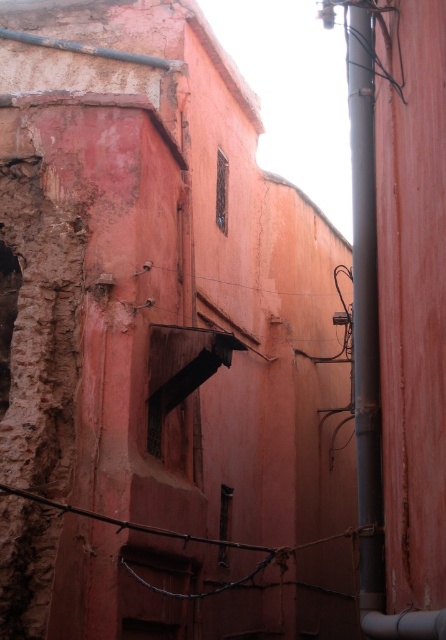
Question: Is metallic pipe at right above rusty metal wire at center?

Choices:
 (A) no
 (B) yes

Answer: (B)

Question: Which of the following is the farthest from the observer?

Choices:
 (A) (351, 150)
 (B) (189, 593)

Answer: (A)

Question: From the image, what is the correct spatial relationship of metallic pipe at right in relation to rusty metal wire at center?

Choices:
 (A) below
 (B) above

Answer: (B)

Question: Among these objects, which one is farthest from the camera?

Choices:
 (A) rusty metal wire at center
 (B) metallic pipe at right

Answer: (A)

Question: Can you confirm if metallic pipe at right is positioned to the right of rusty metal wire at center?

Choices:
 (A) no
 (B) yes

Answer: (B)